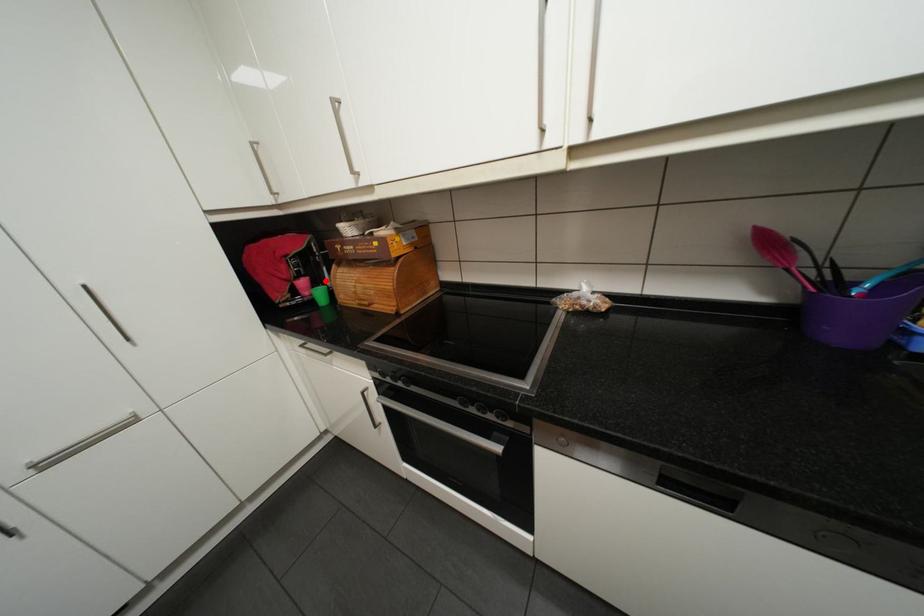
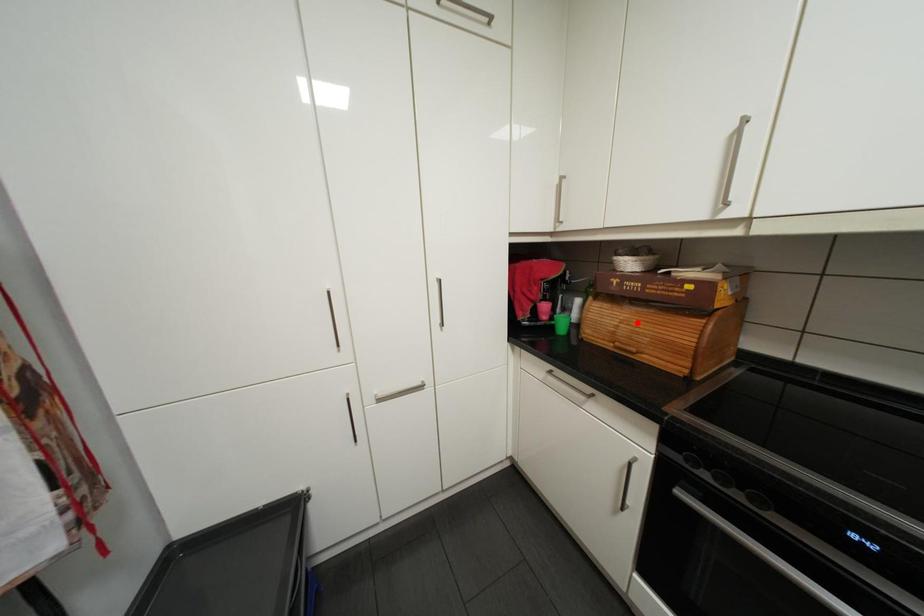
I am providing you with two images of the same scene from different viewpoints. A red point is marked on the first image and another point is marked on the second image. Do the highlighted points in image1 and image2 indicate the same real-world spot?

No